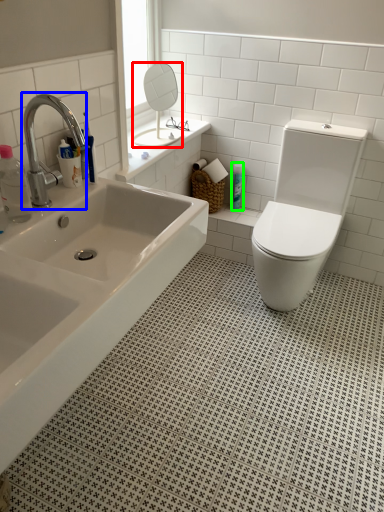
Question: Based on their relative distances, which object is farther from mirror (highlighted by a red box)? Choose from tap (highlighted by a blue box) and toiletry (highlighted by a green box).

Choices:
 (A) tap
 (B) toiletry

Answer: (A)